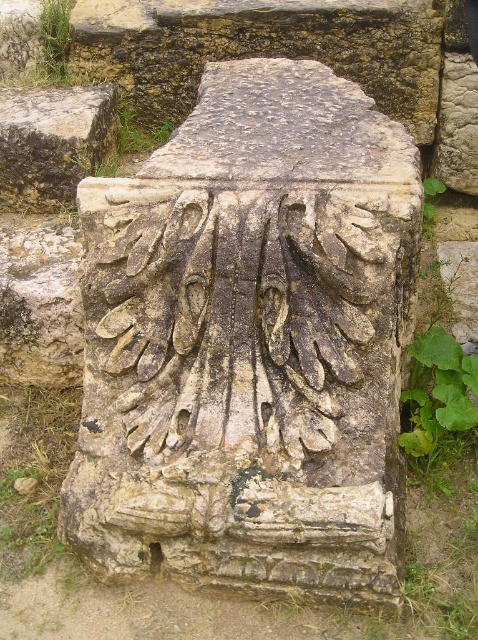
Is point (434, 157) positioned before point (456, 301)?

That is False.

Between carved stone at upper right and carved stone at center, which one appears on the left side from the viewer's perspective?

carved stone at center is more to the left.

Does point (460, 157) come in front of point (441, 273)?

No.

Find the location of a particular element. This screenshot has width=478, height=640. carved stone at upper right is located at coordinates (456, 124).

Who is more forward, [67,353] or [467,96]?

Point [67,353]

Which is in front, point (14, 230) or point (441, 109)?

Point (14, 230) is in front.

You are a GUI agent. You are given a task and a screenshot of the screen. Output one action in this format:
    pyautogui.click(x=<x>, y=<y>)
    Task: Click on the rough stone carving at center
    
    Given the screenshot: What is the action you would take?
    pyautogui.click(x=40, y=300)

Does rough stone carving at center appear on the right side of carved stone at center?

Incorrect, rough stone carving at center is not on the right side of carved stone at center.

Does rough stone carving at center have a lesser height compared to carved stone at center?

No, rough stone carving at center is not shorter than carved stone at center.

Between point (33, 376) and point (445, 257), which one is positioned behind?

Positioned behind is point (445, 257).

The width and height of the screenshot is (478, 640). I want to click on rough stone carving at center, so click(x=40, y=300).